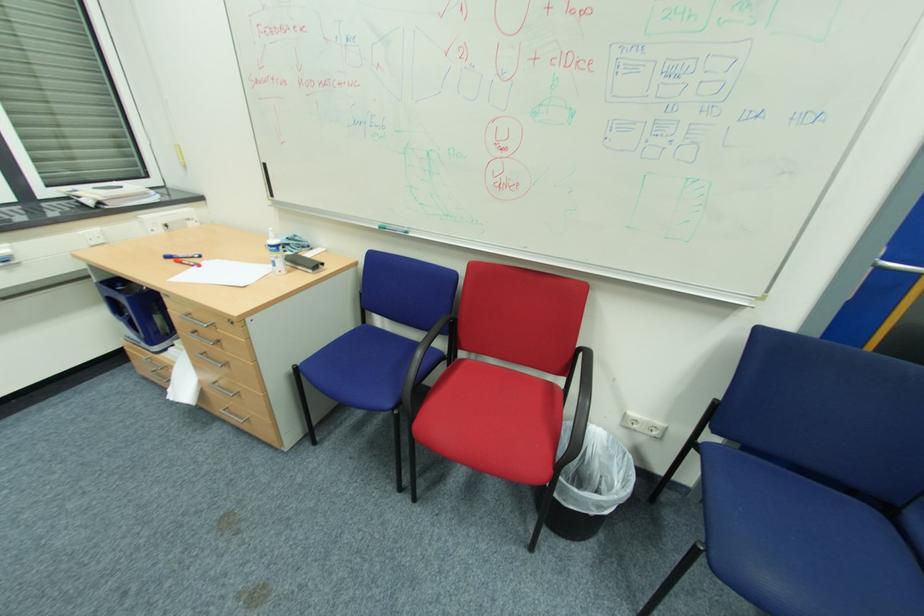
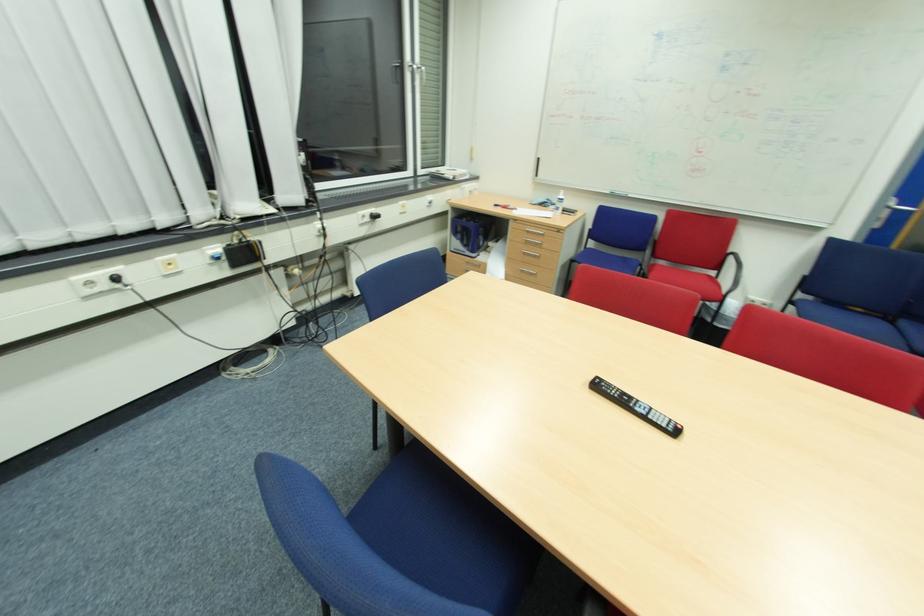
In the second image, find the point that corresponds to pixel 134 338 in the first image.

(462, 249)